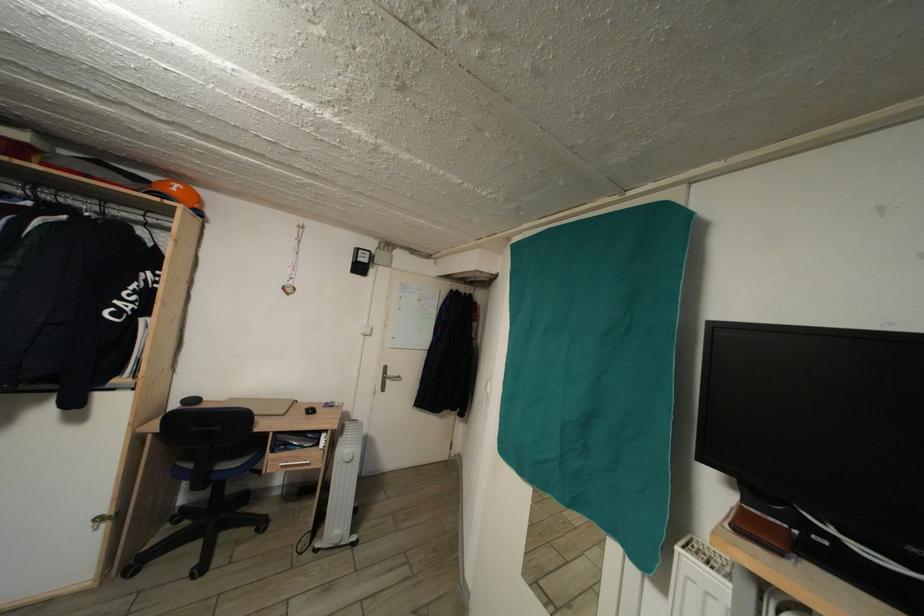
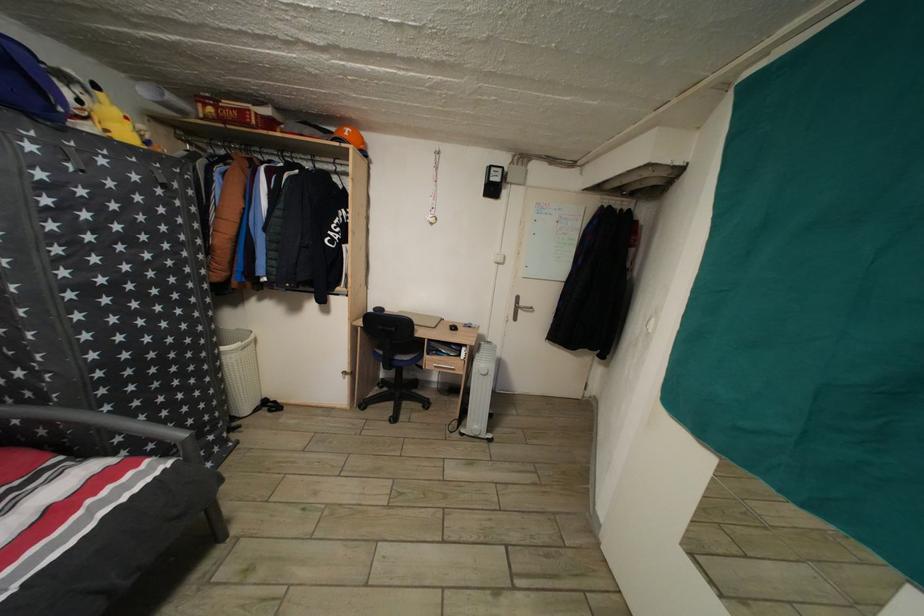
Where in the second image is the point corresponding to point (371, 330) from the first image?

(505, 257)